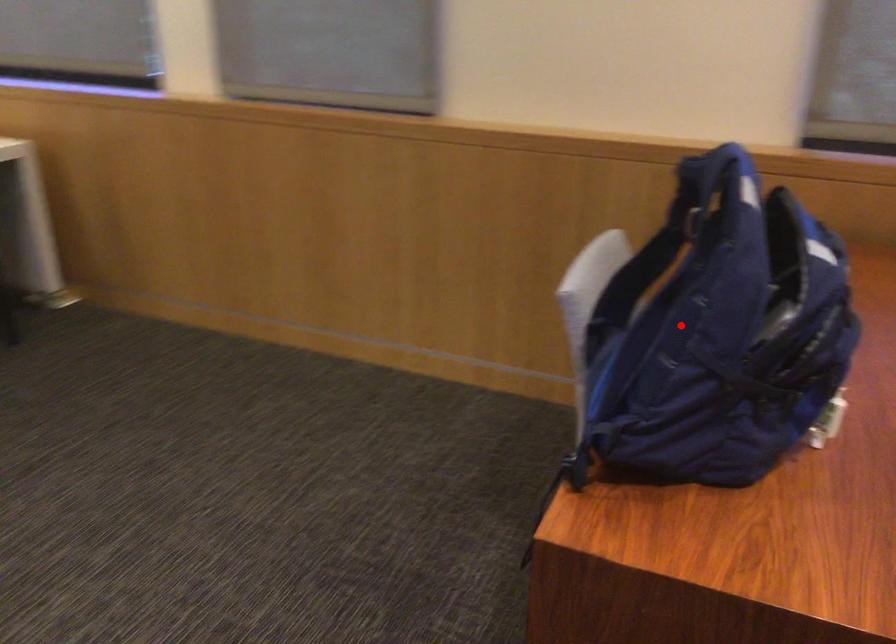
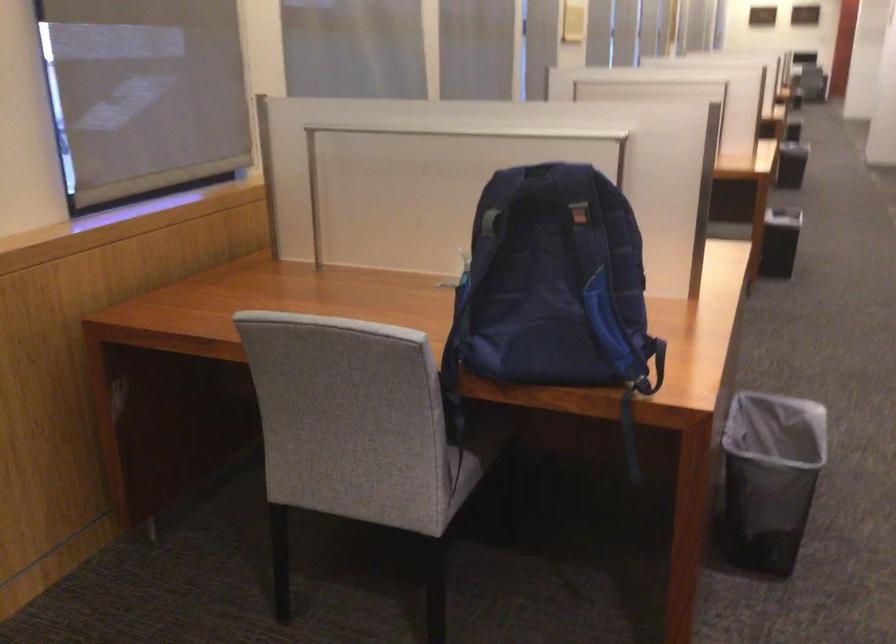
Question: A red point is marked in image1. In image2, is the corresponding 3D point closer to the camera or farther? Reply with the corresponding letter.

Choices:
 (A) The corresponding 3D point is closer.
 (B) The corresponding 3D point is farther.

Answer: (B)